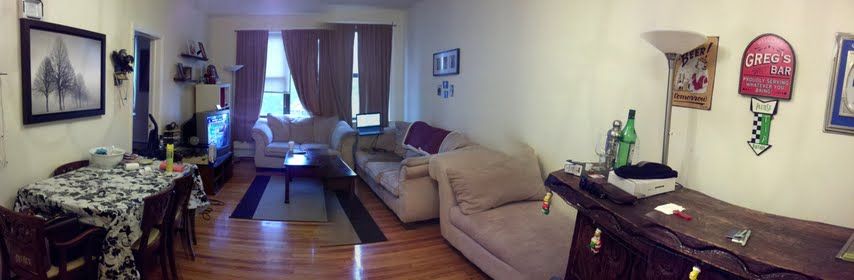
This screenshot has width=854, height=280. Find the location of `walls`. walls is located at coordinates (570, 83), (276, 23), (115, 23).